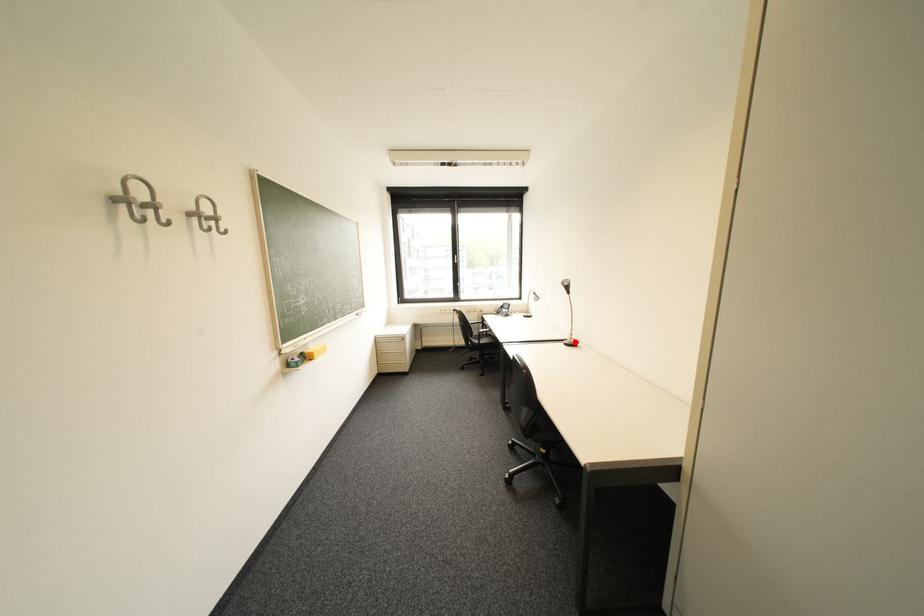
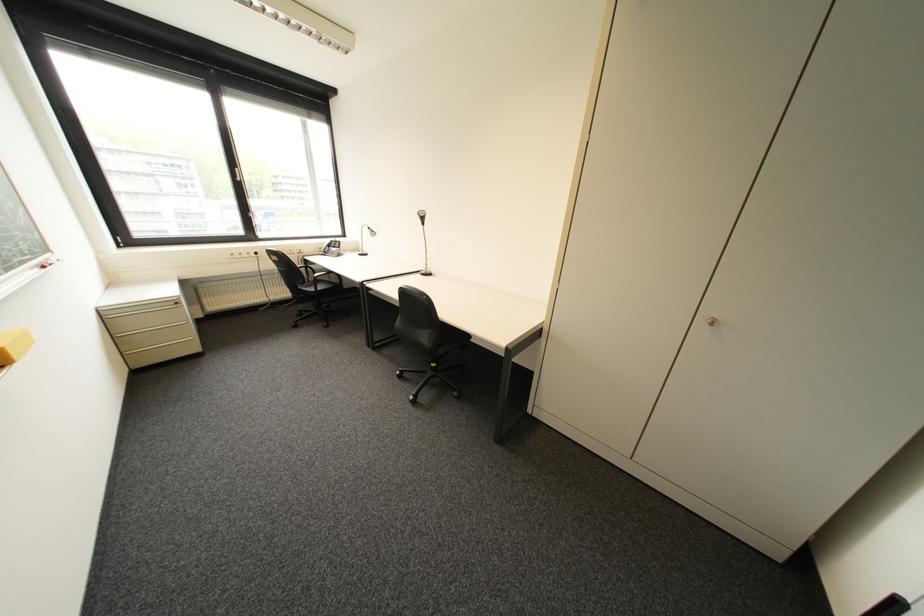
The point at the highlighted location is marked in the first image. Where is the corresponding point in the second image?

(432, 273)